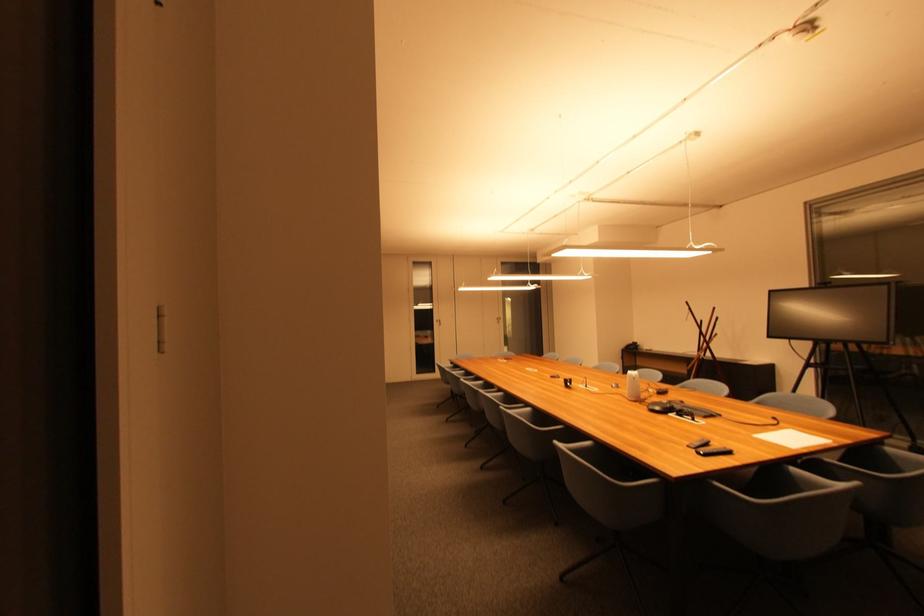
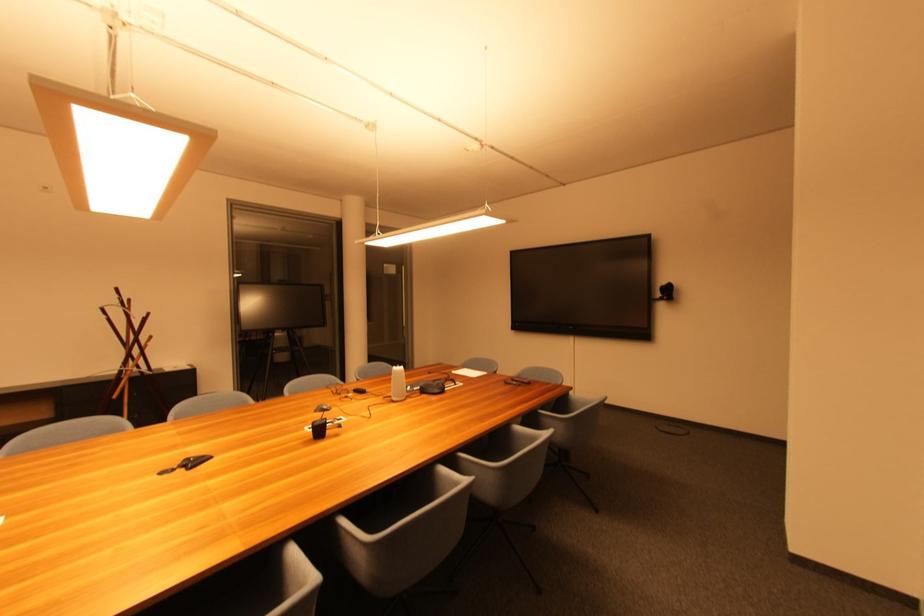
Where in the second image is the point corresponding to point 574,386 from the first image?

(324, 432)